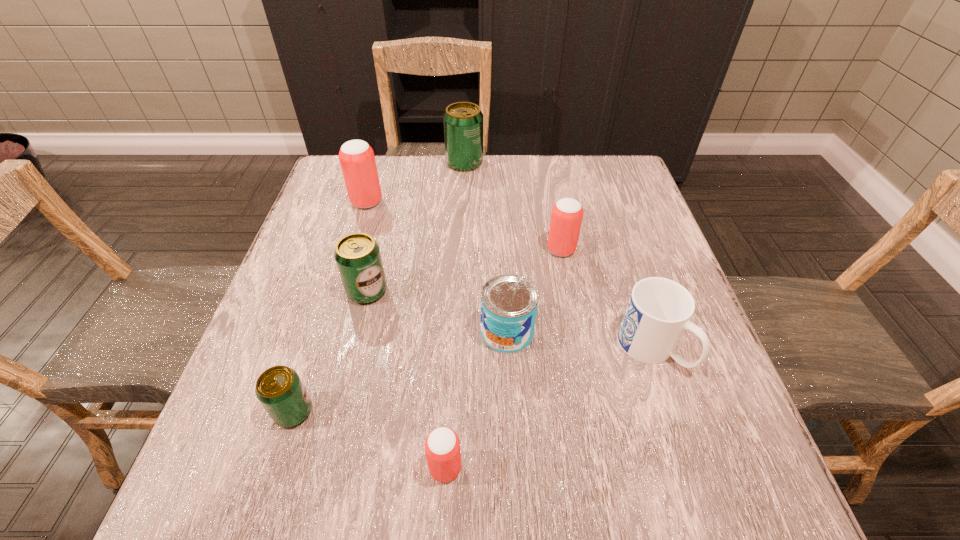
Where is `the rightmost green beer can`? the rightmost green beer can is located at coordinates (463, 121).

Find the location of a particular element. Image resolution: width=960 pixels, height=540 pixels. the biggest green beer can is located at coordinates (463, 121).

The image size is (960, 540). Find the location of `the fifth nearest beer can`. the fifth nearest beer can is located at coordinates (357, 159).

The image size is (960, 540). I want to click on the seventh nearest object, so click(357, 159).

At what (x,y) coordinates should I click in order to perform the action: click on the seventh object from left to right. Please return your answer as a coordinate pair (x, y). Looking at the image, I should click on (566, 218).

You are a GUI agent. You are given a task and a screenshot of the screen. Output one action in this format:
    pyautogui.click(x=<x>, y=<y>)
    Task: Click on the rightmost red beer can
    The height and width of the screenshot is (540, 960).
    Given the screenshot: What is the action you would take?
    pyautogui.click(x=566, y=218)

Locate an element on the screen. The image size is (960, 540). the second biggest green beer can is located at coordinates (357, 255).

This screenshot has width=960, height=540. Find the location of `the third nearest beer can`. the third nearest beer can is located at coordinates (357, 255).

Identify the location of the rightmost object. (659, 310).

You are a GUI agent. You are given a task and a screenshot of the screen. Output one action in this format:
    pyautogui.click(x=<x>, y=<y>)
    Task: Click on the blue mug
    
    Given the screenshot: What is the action you would take?
    pyautogui.click(x=659, y=310)